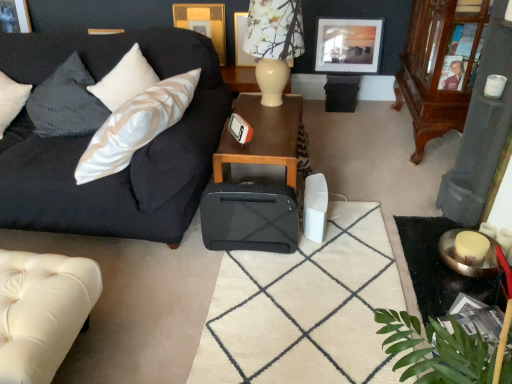
Question: From a real-world perspective, is satin black couch at left, acting as the first studio couch starting from the top, on top of black fabric suitcase at center?

Choices:
 (A) no
 (B) yes

Answer: (B)

Question: Considering the relative positions of satin black couch at left, acting as the first studio couch starting from the top, and black fabric suitcase at center in the image provided, is satin black couch at left, acting as the first studio couch starting from the top, to the right of black fabric suitcase at center from the viewer's perspective?

Choices:
 (A) no
 (B) yes

Answer: (A)

Question: Does satin black couch at left, acting as the first studio couch starting from the top, have a smaller size compared to black fabric suitcase at center?

Choices:
 (A) yes
 (B) no

Answer: (B)

Question: From a real-world perspective, is satin black couch at left, the 2th studio couch positioned from the bottom, under black fabric suitcase at center?

Choices:
 (A) yes
 (B) no

Answer: (B)

Question: From the image's perspective, is satin black couch at left, the 2th studio couch positioned from the bottom, located above black fabric suitcase at center?

Choices:
 (A) yes
 (B) no

Answer: (A)

Question: In terms of width, does white ceramic lamp at upper center look wider or thinner when compared to black fabric suitcase at center?

Choices:
 (A) thin
 (B) wide

Answer: (A)

Question: From a real-world perspective, is white ceramic lamp at upper center physically located above or below black fabric suitcase at center?

Choices:
 (A) above
 (B) below

Answer: (A)

Question: From the image's perspective, is white ceramic lamp at upper center positioned above or below black fabric suitcase at center?

Choices:
 (A) above
 (B) below

Answer: (A)

Question: Is white ceramic lamp at upper center taller or shorter than black fabric suitcase at center?

Choices:
 (A) tall
 (B) short

Answer: (A)

Question: Is white ceramic lamp at upper center spatially inside wooden picture frame at upper left, acting as the 4th picture frame starting from the right, or outside of it?

Choices:
 (A) outside
 (B) inside

Answer: (A)

Question: From the image's perspective, relative to wooden picture frame at upper left, acting as the 4th picture frame starting from the right, is white ceramic lamp at upper center above or below?

Choices:
 (A) below
 (B) above

Answer: (A)

Question: Is point (283, 79) positioned closer to the camera than point (0, 26)?

Choices:
 (A) closer
 (B) farther

Answer: (A)

Question: Visually, is white ceramic lamp at upper center positioned to the left or to the right of wooden picture frame at upper left, acting as the 4th picture frame starting from the right?

Choices:
 (A) right
 (B) left

Answer: (A)

Question: In the image, is white leather studio couch at lower left, the 1th studio couch positioned from the bottom, positioned in front of or behind wooden picture frame at upper left, placed as the 1th picture frame when sorted from left to right?

Choices:
 (A) front
 (B) behind

Answer: (A)

Question: In terms of height, does white leather studio couch at lower left, the 1th studio couch positioned from the bottom, look taller or shorter compared to wooden picture frame at upper left, acting as the 4th picture frame starting from the right?

Choices:
 (A) short
 (B) tall

Answer: (B)